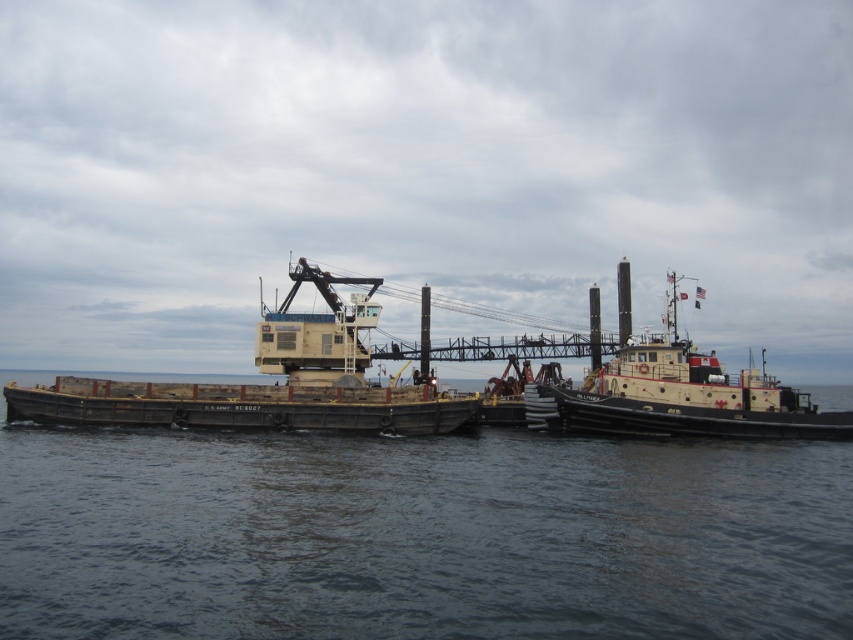
Consider the image. You are a sailor on the yellow matte tugboat at center. You need to secure a rope to the barge that is on the other side of the dark gray water at center. Considering the height difference between the two, will you need a ladder to reach the barge?

The dark gray water at center has a lesser height compared to yellow matte tugboat at center, meaning the barge is likely at a lower level. Therefore, you may need a ladder to descend to the barge level.

You are a sailor on the dark gray water at center and need to reach the yellow matte barge at center. Which direction should you head to get there?

The dark gray water at center is in front of the yellow matte barge at center, so you should head towards the barge by moving forward from your current position on the dark gray water at center.